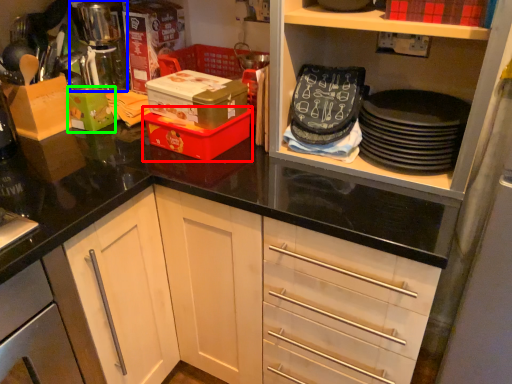
Question: Based on their relative distances, which object is farther from box (highlighted by a red box)? Choose from coffee machine (highlighted by a blue box) and box (highlighted by a green box).

Choices:
 (A) coffee machine
 (B) box

Answer: (A)